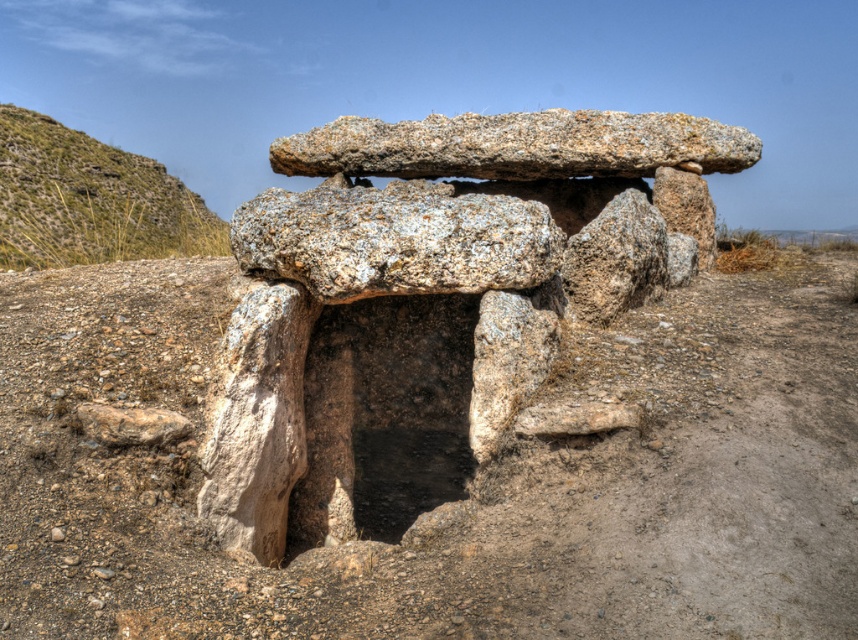
You are planning to place a small picnic blanket on the ground near the granite rock formation at center and the green grassy hill at upper left. Which area would allow the blanket to fit better based on their widths?

The granite rock formation at center has a greater width than the green grassy hill at upper left, so placing the picnic blanket near the granite rock formation at center would provide more space.

You are standing at the point marked as point (450, 387) near the ancient dolmen. You want to take a photo of the dolmen using a camera that has a maximum focus range of 6 meters. Will the camera be able to focus on the dolmen from your current position?

The distance between point (450, 387) and the camera is 6.52 meters. Since the camera can only focus up to 6 meters, it will not be able to focus on the dolmen from this position.

In the scene shown: You are an archaeologist examining the ancient dolmen. You notice the granite rock formation at center and the green grassy hill at upper left. Which of these two features is larger in size?

The granite rock formation at center is bigger than the green grassy hill at upper left according to the description provided.